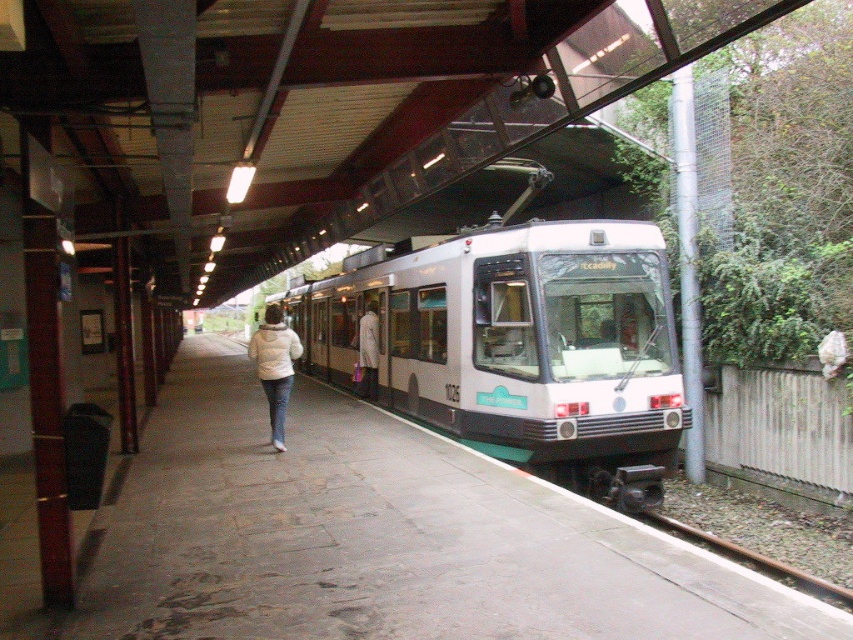
You are standing on the train station platform and want to know the exact coordinates of the concrete platform at center. What are its coordinates?

The concrete platform at center is located at coordinates point (384, 536).

You are a passenger standing on the concrete platform at center. You see a white fleece jacket at center nearby. Can you estimate which object takes up more area on the platform?

The white fleece jacket at center occupies more space than the concrete platform at center.